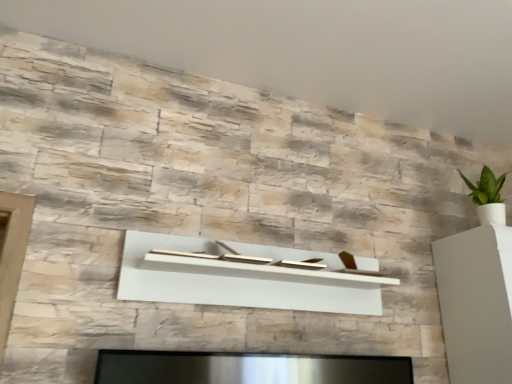
Question: Is natural stone wall at upper center wider or thinner than white matte shelf at center?

Choices:
 (A) thin
 (B) wide

Answer: (B)

Question: In the image, is natural stone wall at upper center positioned in front of or behind white matte shelf at center?

Choices:
 (A) front
 (B) behind

Answer: (A)

Question: Which object is positioned farthest from the white glossy vase at right?

Choices:
 (A) white matte shelf at center
 (B) natural stone wall at upper center

Answer: (B)

Question: Based on their relative distances, which object is farther from the white matte shelf at center?

Choices:
 (A) white glossy vase at right
 (B) natural stone wall at upper center

Answer: (B)